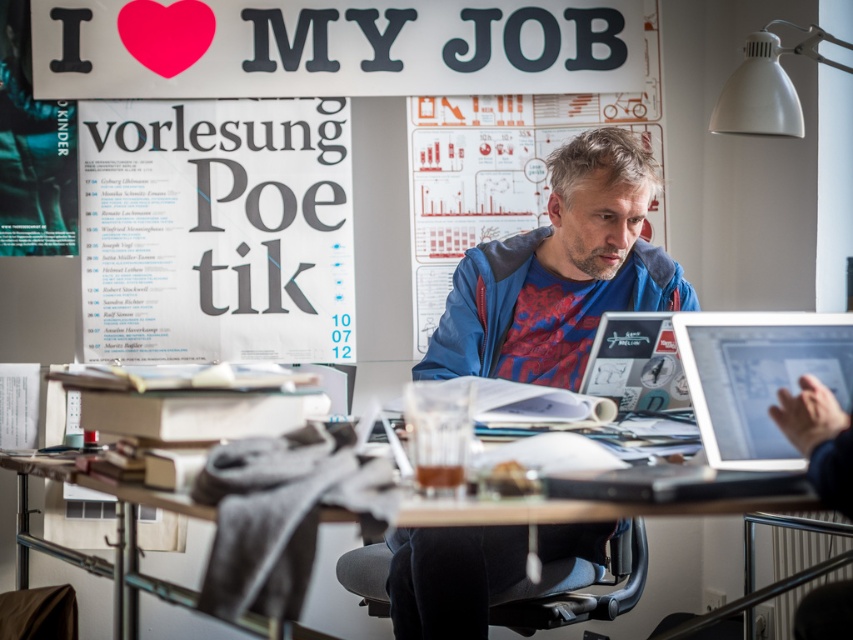
Consider the image. You are organizing a presentation and need to place a new poster on the wall. The existing white paper poster at upper left and wooden table at center are already in the scene. Which object should you move to the right to make space for the new poster?

You should move the wooden table at center to the right to make space for the new poster since the white paper poster at upper left is already positioned to the left of it.

From the picture: You are a delivery person who needs to place a package on the desk without moving any existing items. The package is 3 feet long. Can you fit it between the matte silver laptop at right and the white matte lampshade at upper right?

The distance between the matte silver laptop at right and the white matte lampshade at upper right is 4.05 feet, which is longer than the 3 feet package. Therefore, the package can be placed between them without moving any items.